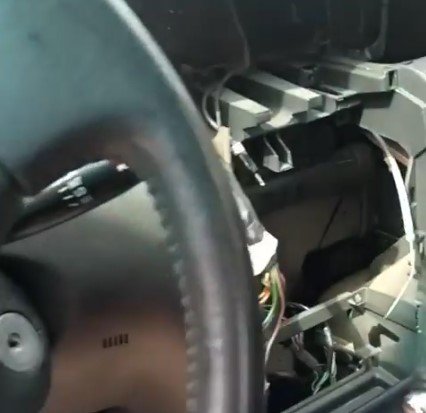
I want to click on handle, so click(x=72, y=186).